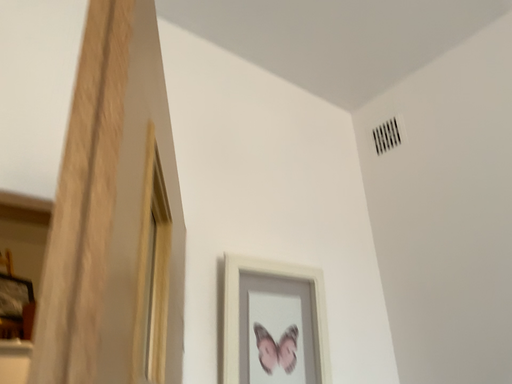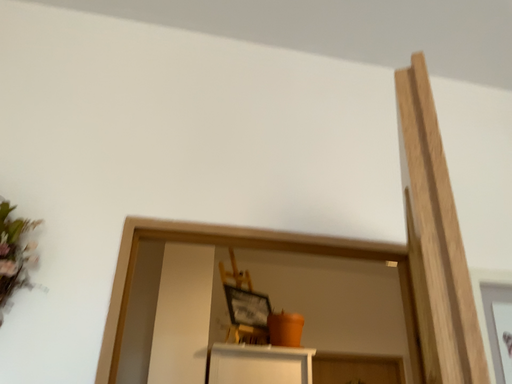
Question: How did the camera likely rotate when shooting the video?

Choices:
 (A) rotated right
 (B) rotated left

Answer: (B)